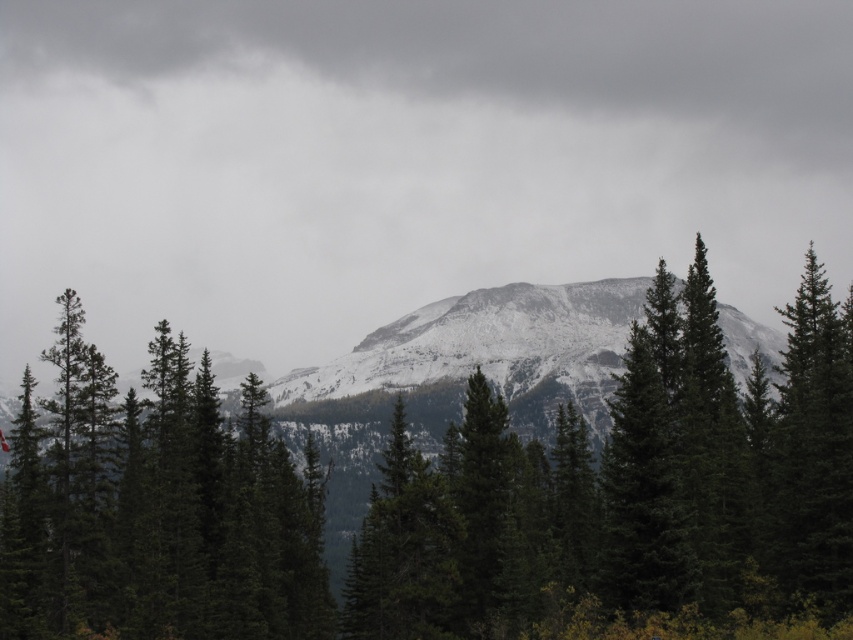
You are a hiker trying to navigate through the mountain path. You see two points marked on your map at coordinates point [527,531] and point [140,508]. Which point is farther away from your current position?

Point [527,531] is behind point [140,508], so it is farther away from your current position.